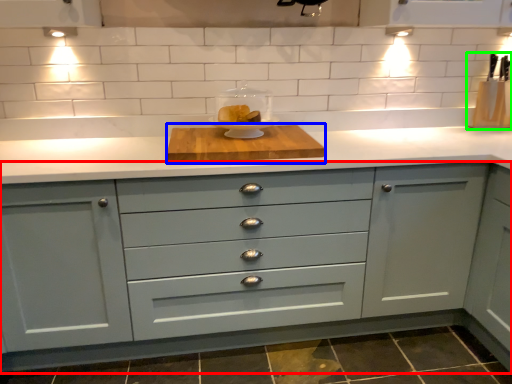
Question: Which object is positioned closest to cabinetry (highlighted by a red box)? Select from cutting board (highlighted by a blue box) and appliance (highlighted by a green box).

Choices:
 (A) cutting board
 (B) appliance

Answer: (A)